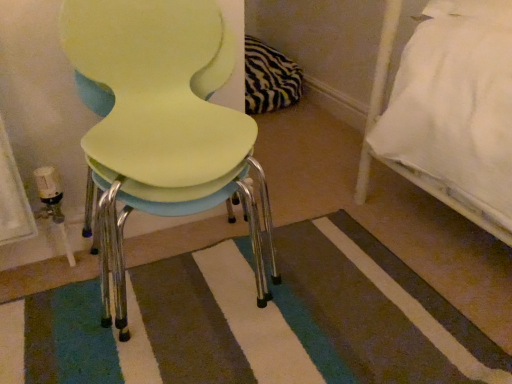
The image size is (512, 384). What are the coordinates of `free point above striped carpet at center (from a real-world perspective)` in the screenshot? It's located at (249, 264).